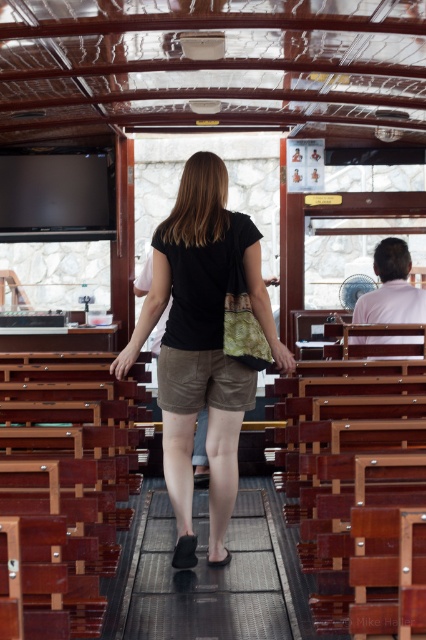
Question: Can you confirm if black matte shorts at center is positioned to the right of black rubber mat at center?

Choices:
 (A) yes
 (B) no

Answer: (B)

Question: Can you confirm if black matte shorts at center is wider than black rubber mat at center?

Choices:
 (A) no
 (B) yes

Answer: (B)

Question: Which object is closer to the camera taking this photo?

Choices:
 (A) black rubber mat at center
 (B) black matte shorts at center

Answer: (A)

Question: Is black matte shorts at center smaller than black rubber mat at center?

Choices:
 (A) no
 (B) yes

Answer: (A)

Question: Among these objects, which one is nearest to the camera?

Choices:
 (A) black matte shorts at center
 (B) black rubber mat at center

Answer: (B)

Question: Among these objects, which one is farthest from the camera?

Choices:
 (A) black matte shorts at center
 (B) black rubber mat at center

Answer: (A)